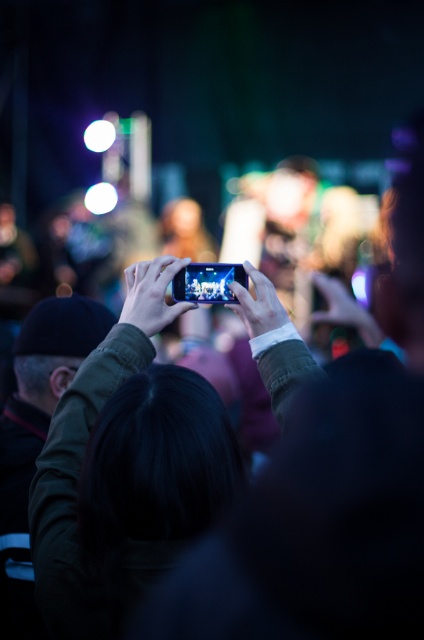
Question: Among these points, which one is nearest to the camera?

Choices:
 (A) (248, 285)
 (B) (293, 340)

Answer: (B)

Question: Which point is closer to the camera?

Choices:
 (A) matte black phone at upper center
 (B) shiny black phone at center

Answer: (B)

Question: Can you confirm if shiny black phone at center is positioned above matte black phone at upper center?

Choices:
 (A) yes
 (B) no

Answer: (B)

Question: Does shiny black phone at center have a greater width compared to matte black phone at upper center?

Choices:
 (A) no
 (B) yes

Answer: (B)

Question: Is shiny black phone at center positioned before matte black phone at upper center?

Choices:
 (A) yes
 (B) no

Answer: (A)